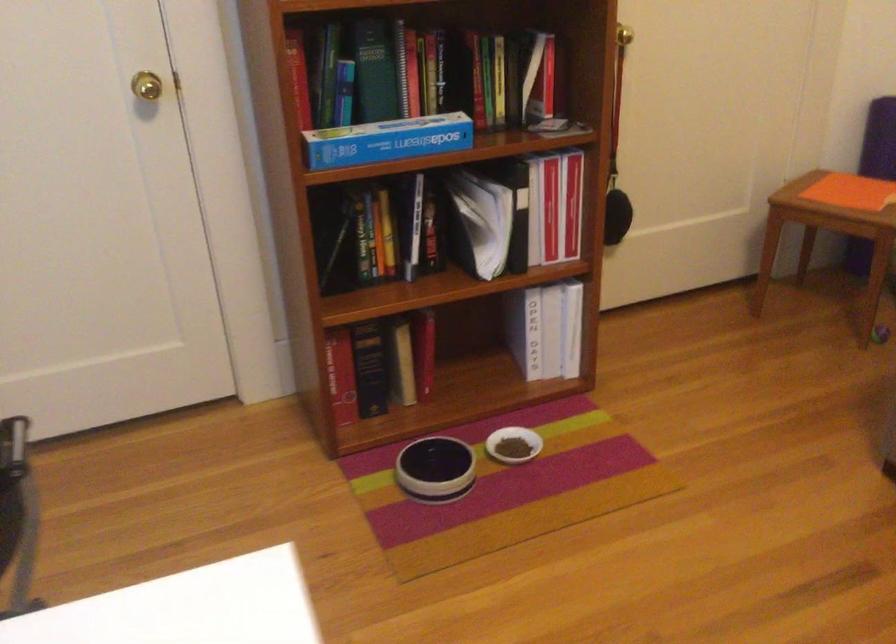
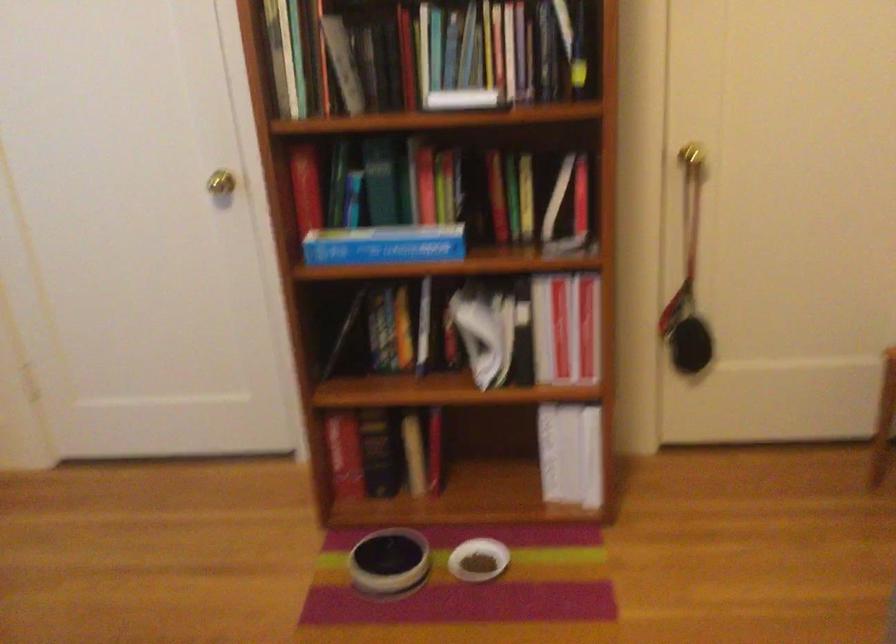
Question: The images are taken continuously from a first-person perspective. In which direction are you moving?

Choices:
 (A) Left
 (B) Right
 (C) Forward
 (D) Backward

Answer: (B)